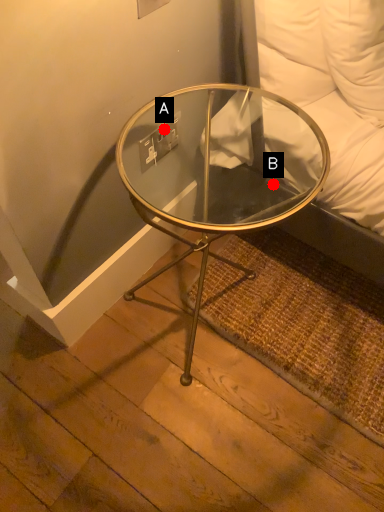
Question: Two points are circled on the image, labeled by A and B beside each circle. Which point appears closest to the camera in this image?

Choices:
 (A) A is closer
 (B) B is closer

Answer: (A)